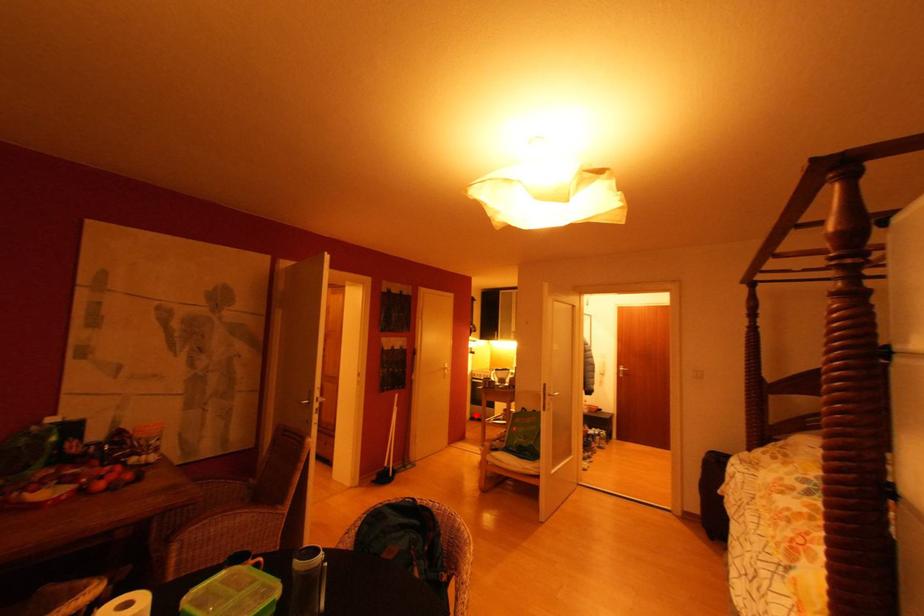
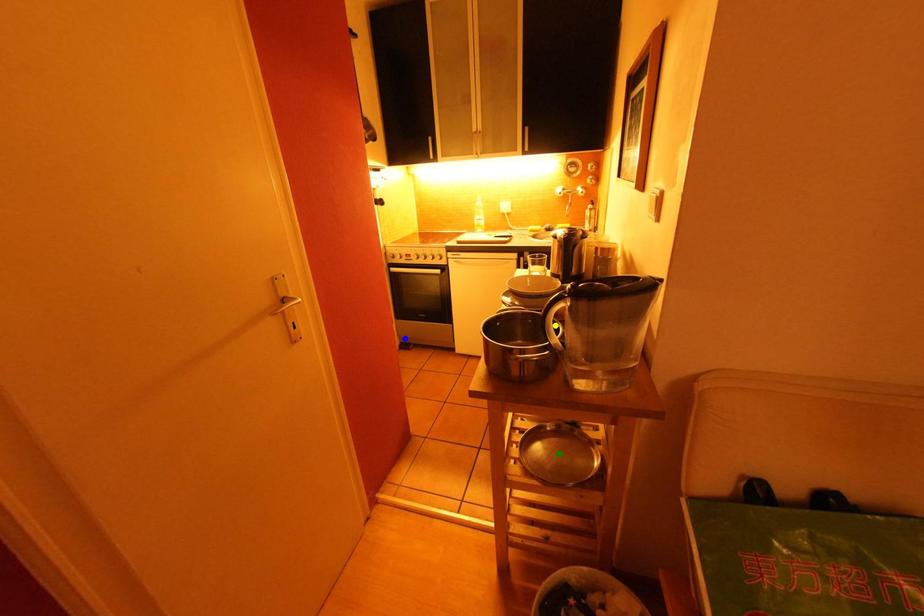
Question: I am providing you with two images of the same scene from different viewpoints. A red point is marked on the first image. You are given multiple points on the second image. Which point in image 2 is actually the same real-world point as the red point in image 1?

Choices:
 (A) green point
 (B) blue point
 (C) yellow point

Answer: (B)